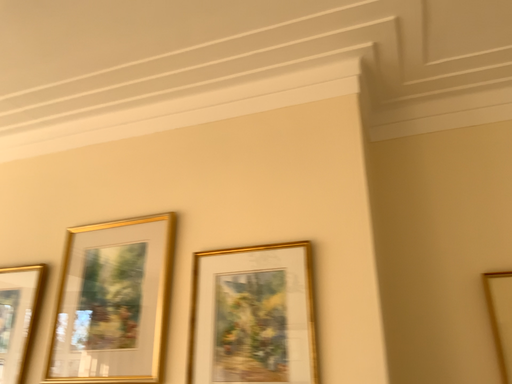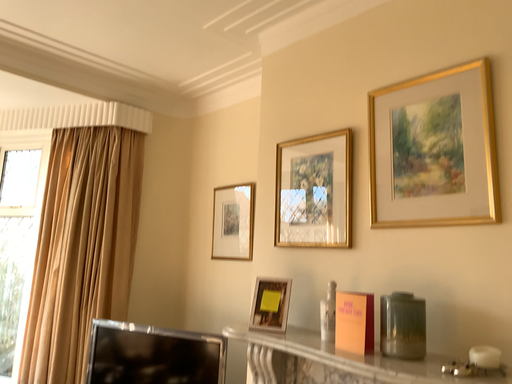
Question: How did the camera likely rotate when shooting the video?

Choices:
 (A) rotated right
 (B) rotated left

Answer: (B)